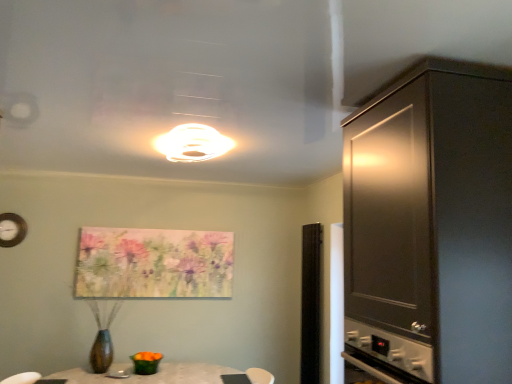
Question: Does dark wood cabinet at right appear on the left side of pastel floral canvas at center?

Choices:
 (A) yes
 (B) no

Answer: (B)

Question: From the image's perspective, would you say dark wood cabinet at right is positioned over pastel floral canvas at center?

Choices:
 (A) no
 (B) yes

Answer: (B)

Question: From a real-world perspective, does dark wood cabinet at right stand above pastel floral canvas at center?

Choices:
 (A) yes
 (B) no

Answer: (A)

Question: Is dark wood cabinet at right closer to camera compared to pastel floral canvas at center?

Choices:
 (A) no
 (B) yes

Answer: (B)

Question: Is dark wood cabinet at right at the right side of pastel floral canvas at center?

Choices:
 (A) no
 (B) yes

Answer: (B)

Question: Considering the relative sizes of dark wood cabinet at right and pastel floral canvas at center in the image provided, is dark wood cabinet at right wider than pastel floral canvas at center?

Choices:
 (A) no
 (B) yes

Answer: (B)

Question: From the image's perspective, is white glossy light fixture at upper center beneath pastel floral canvas at center?

Choices:
 (A) yes
 (B) no

Answer: (B)

Question: Can you confirm if white glossy light fixture at upper center is smaller than pastel floral canvas at center?

Choices:
 (A) no
 (B) yes

Answer: (B)

Question: Is white glossy light fixture at upper center behind pastel floral canvas at center?

Choices:
 (A) yes
 (B) no

Answer: (B)

Question: Would you say white glossy light fixture at upper center is outside pastel floral canvas at center?

Choices:
 (A) yes
 (B) no

Answer: (A)

Question: Considering the relative positions of white glossy light fixture at upper center and pastel floral canvas at center in the image provided, is white glossy light fixture at upper center in front of pastel floral canvas at center?

Choices:
 (A) no
 (B) yes

Answer: (B)

Question: Is white glossy light fixture at upper center oriented away from pastel floral canvas at center?

Choices:
 (A) yes
 (B) no

Answer: (B)

Question: Is transparent glass door at center taller than white glossy light fixture at upper center?

Choices:
 (A) yes
 (B) no

Answer: (A)